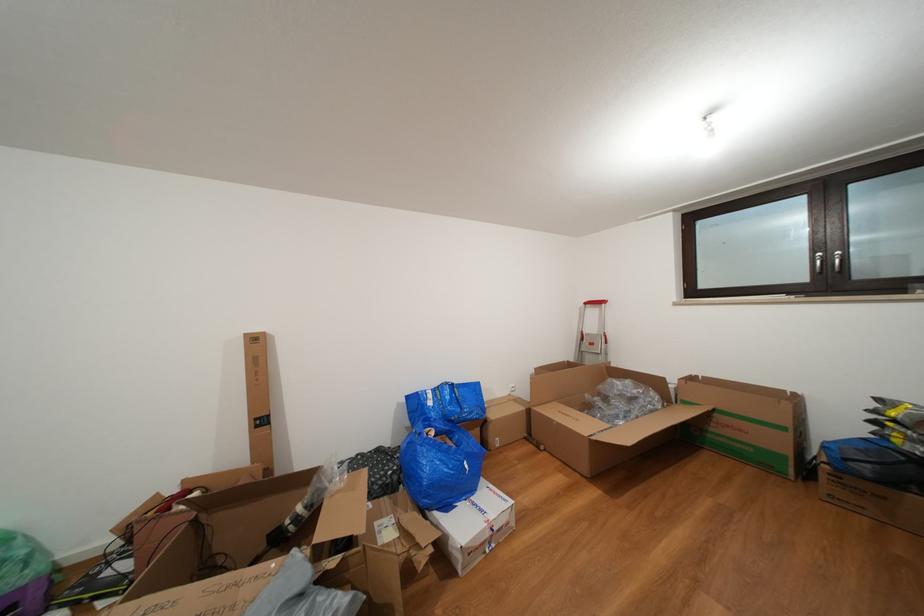
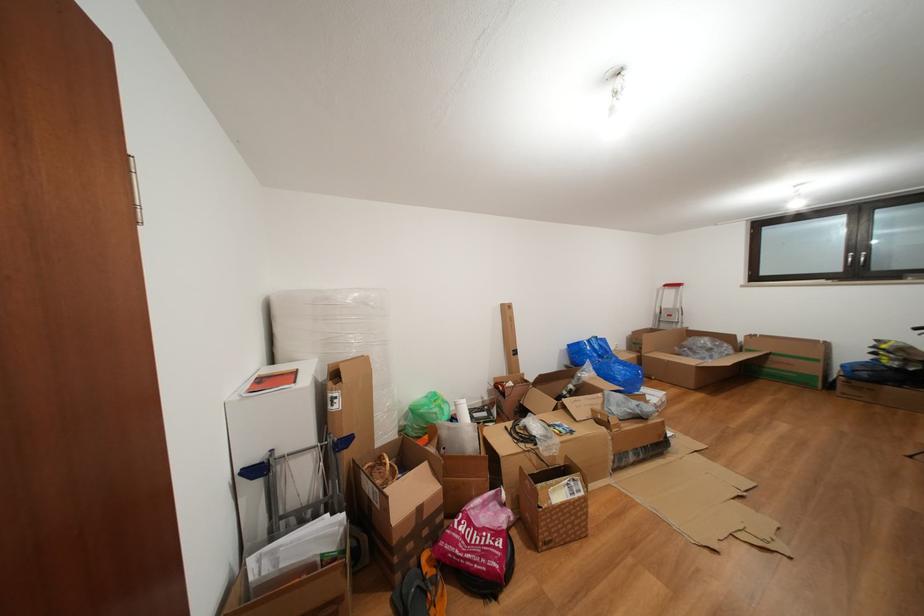
Find the pixel in the second image that matches point (594, 309) in the first image.

(674, 291)